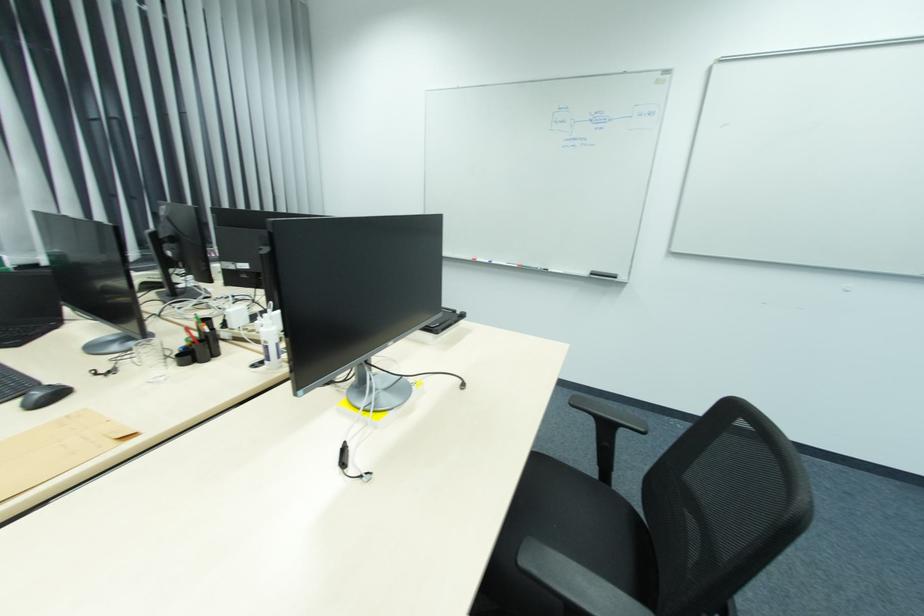
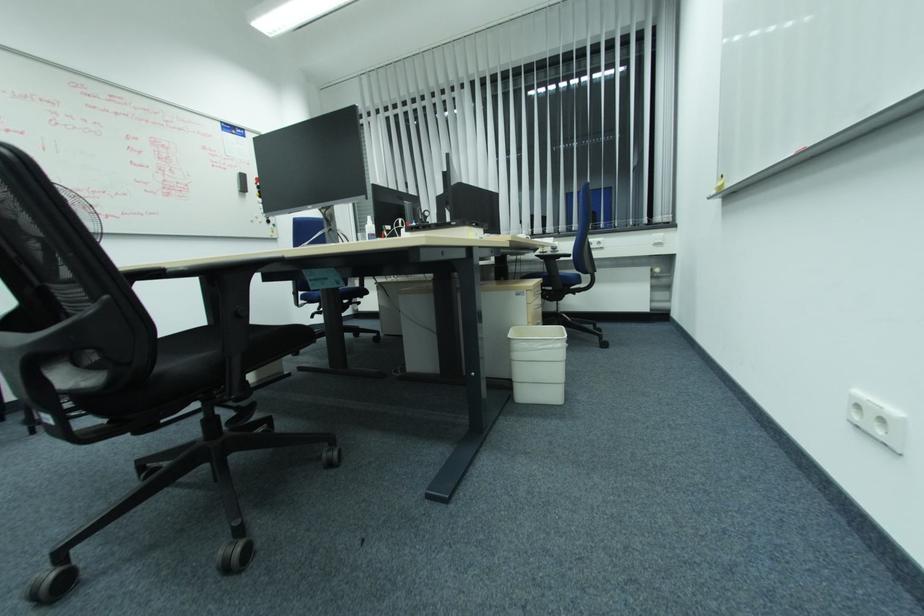
Question: I am providing you with two images of the same scene from different viewpoints. Which of the following objects are not visible in image2?

Choices:
 (A) blue chair sitting surface
 (B) white trash can
 (C) blue sitting bench
 (D) glass cup

Answer: (D)